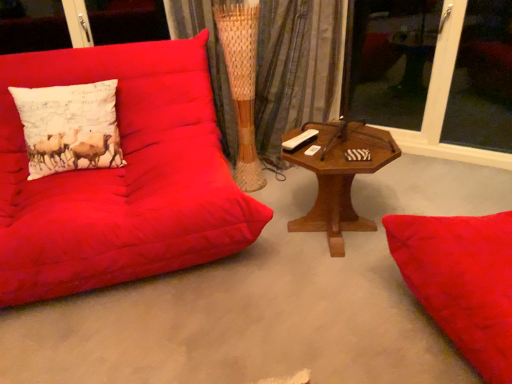
Identify the location of free region on the left part of woodenobject at center. The width and height of the screenshot is (512, 384). (250, 251).